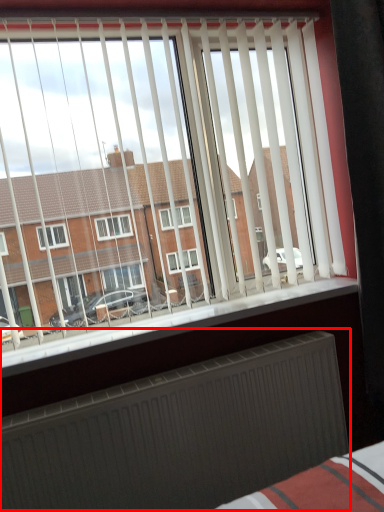
Question: From the image's perspective, where is radiator (annotated by the red box) located relative to window sill?

Choices:
 (A) below
 (B) above

Answer: (A)